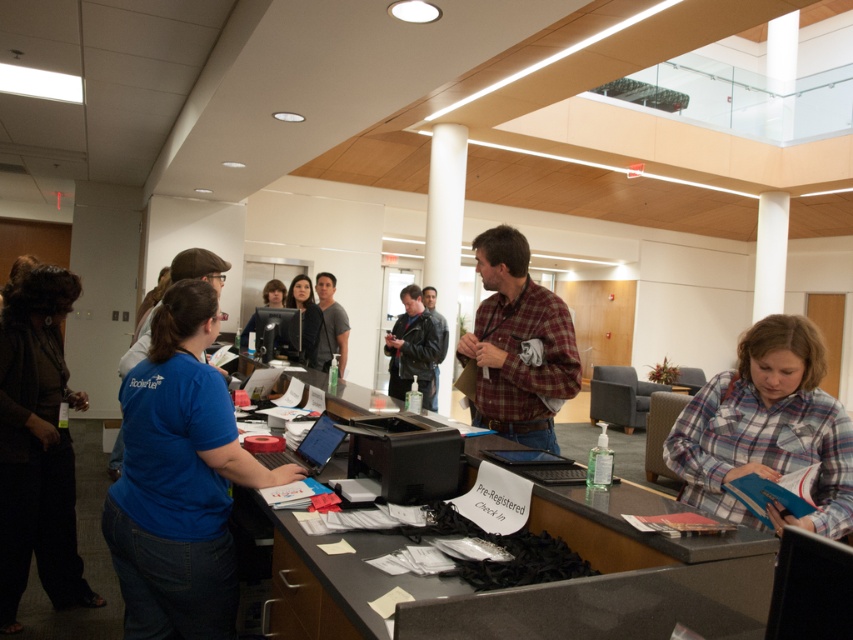
Who is lower down, plaid flannel shirt at lower right or matte black shirt at center?

Positioned lower is plaid flannel shirt at lower right.

Measure the distance between point (737, 356) and camera.

Point (737, 356) and camera are 9.78 feet apart from each other.

Which is behind, point (767, 456) or point (321, 314)?

Positioned behind is point (321, 314).

Where is `plaid flannel shirt at lower right`? plaid flannel shirt at lower right is located at coordinates (767, 426).

Between plaid flannel shirt at lower right and matte black monitor at center, which one has less height?

With less height is matte black monitor at center.

Is the position of plaid flannel shirt at lower right more distant than that of matte black monitor at center?

That is False.

Is point (813, 426) less distant than point (274, 296)?

Yes.

Identify the location of plaid flannel shirt at lower right. This screenshot has width=853, height=640. (767, 426).

Who is lower down, leather jacket at center or matte black monitor at center?

leather jacket at center is below.

Find the location of a particular element. leather jacket at center is located at coordinates pos(412,348).

The height and width of the screenshot is (640, 853). What do you see at coordinates (412, 348) in the screenshot? I see `leather jacket at center` at bounding box center [412, 348].

Identify the location of leather jacket at center. The width and height of the screenshot is (853, 640). coord(412,348).